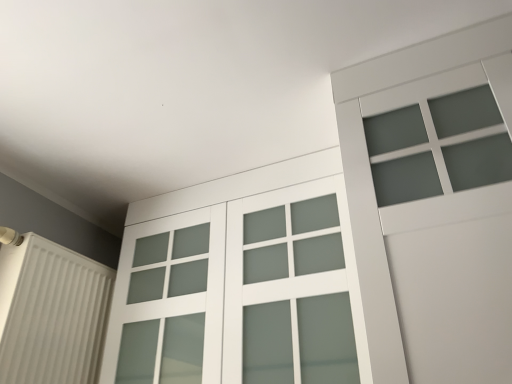
The width and height of the screenshot is (512, 384). What are the coordinates of `white matte radiator at left` in the screenshot? It's located at (51, 313).

The height and width of the screenshot is (384, 512). What do you see at coordinates (51, 313) in the screenshot? I see `white matte radiator at left` at bounding box center [51, 313].

At what (x,y) coordinates should I click in order to perform the action: click on satin white glass door at center. Please return your answer as a coordinate pair (x, y). The width and height of the screenshot is (512, 384). Looking at the image, I should click on (239, 294).

In order to face satin white glass door at center, should I rotate leftwards or rightwards?

Rotate left and turn 2.609 degrees.

The height and width of the screenshot is (384, 512). What do you see at coordinates (239, 294) in the screenshot?
I see `satin white glass door at center` at bounding box center [239, 294].

What is the approximate height of satin white glass door at center?

satin white glass door at center is 80.35 centimeters in height.

The width and height of the screenshot is (512, 384). I want to click on white matte radiator at left, so click(51, 313).

Considering the positions of objects satin white glass door at center and white matte radiator at left in the image provided, who is more to the right, satin white glass door at center or white matte radiator at left?

satin white glass door at center.

Is satin white glass door at center positioned in front of white matte radiator at left?

Yes, it is in front of white matte radiator at left.

Does point (322, 251) come in front of point (15, 366)?

No, it is behind (15, 366).

From the image's perspective, relative to white matte radiator at left, is satin white glass door at center above or below?

satin white glass door at center is above white matte radiator at left.

In the scene shown: From a real-world perspective, which is physically below, satin white glass door at center or white matte radiator at left?

white matte radiator at left, from a real-world perspective.

Which object is wider, satin white glass door at center or white matte radiator at left?

Wider between the two is satin white glass door at center.

Looking at this image, which of these two, satin white glass door at center or white matte radiator at left, stands shorter?

white matte radiator at left is shorter.

From the picture: Does satin white glass door at center have a larger size compared to white matte radiator at left?

Indeed, satin white glass door at center has a larger size compared to white matte radiator at left.

Do you think satin white glass door at center is within white matte radiator at left, or outside of it?

satin white glass door at center is outside white matte radiator at left.

Are satin white glass door at center and white matte radiator at left making contact?

They are not placed beside each other.

Is satin white glass door at center looking in the opposite direction of white matte radiator at left?

No, white matte radiator at left is not at the back of satin white glass door at center.

How many degrees apart are the facing directions of satin white glass door at center and white matte radiator at left?

satin white glass door at center and white matte radiator at left are facing 88.3 degrees away from each other.

In order to click on shutter below the satin white glass door at center (from a real-world perspective) in this screenshot , I will do `click(51, 313)`.

Considering the positions of objects white matte radiator at left and satin white glass door at center in the image provided, who is more to the right, white matte radiator at left or satin white glass door at center?

From the viewer's perspective, satin white glass door at center appears more on the right side.

Is white matte radiator at left positioned before satin white glass door at center?

No, it is not.

Is point (75, 271) more distant than point (290, 255)?

Yes.

Looking at this image, from the image's perspective, does white matte radiator at left appear lower than satin white glass door at center?

Indeed, from the image's perspective, white matte radiator at left is shown beneath satin white glass door at center.

From a real-world perspective, is white matte radiator at left physically located above or below satin white glass door at center?

Clearly, from a real-world perspective, white matte radiator at left is below satin white glass door at center.

Considering the sizes of objects white matte radiator at left and satin white glass door at center in the image provided, who is thinner, white matte radiator at left or satin white glass door at center?

Thinner between the two is white matte radiator at left.

Between white matte radiator at left and satin white glass door at center, which one has less height?

Standing shorter between the two is white matte radiator at left.

Considering the sizes of objects white matte radiator at left and satin white glass door at center in the image provided, who is bigger, white matte radiator at left or satin white glass door at center?

With larger size is satin white glass door at center.

Is white matte radiator at left positioned beyond the bounds of satin white glass door at center?

That's correct, white matte radiator at left is outside of satin white glass door at center.

Are white matte radiator at left and satin white glass door at center located far from each other?

They are positioned close to each other.

Could you tell me if white matte radiator at left is turned towards satin white glass door at center?

Yes, white matte radiator at left is facing satin white glass door at center.

Where is `glass door above the white matte radiator at left (from the image's perspective)`? glass door above the white matte radiator at left (from the image's perspective) is located at coordinates (239, 294).

Where is `glass door in front of the white matte radiator at left`? This screenshot has height=384, width=512. glass door in front of the white matte radiator at left is located at coordinates (239, 294).

This screenshot has height=384, width=512. Find the location of `shutter lying below the satin white glass door at center (from the image's perspective)`. shutter lying below the satin white glass door at center (from the image's perspective) is located at coordinates (51, 313).